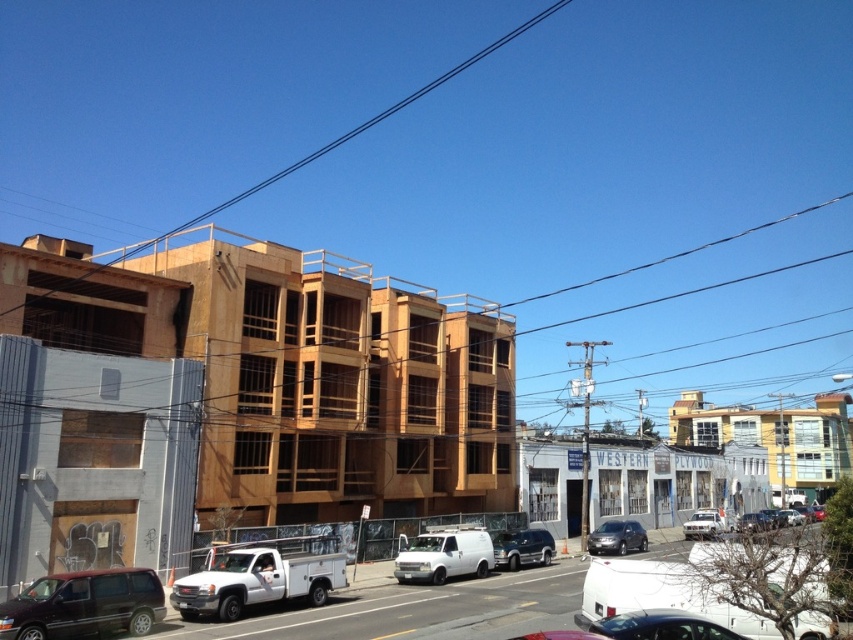
Based on the photo, is white matte van at center to the right of metallic silver van at center from the viewer's perspective?

In fact, white matte van at center is to the left of metallic silver van at center.

Does white matte van at center lie in front of metallic silver van at center?

Yes, white matte van at center is closer to the viewer.

Which is in front, point (430, 550) or point (535, 545)?

Point (430, 550)

Where is `white matte van at center`? This screenshot has height=640, width=853. white matte van at center is located at coordinates tap(444, 556).

Who is higher up, matte black van at lower left or white matte van at center?

Positioned higher is matte black van at lower left.

Is matte black van at lower left wider than white matte van at center?

Indeed, matte black van at lower left has a greater width compared to white matte van at center.

Is point (126, 588) closer to camera compared to point (426, 541)?

That is True.

Where is `matte black van at lower left`? Image resolution: width=853 pixels, height=640 pixels. matte black van at lower left is located at coordinates (84, 604).

Between point (21, 620) and point (525, 545), which one is positioned behind?

Positioned behind is point (525, 545).

From the picture: Does matte black van at lower left appear over metallic silver van at center?

Indeed, matte black van at lower left is positioned over metallic silver van at center.

Which is in front, point (111, 570) or point (527, 541)?

Positioned in front is point (111, 570).

Where is `matte black van at lower left`? matte black van at lower left is located at coordinates (84, 604).